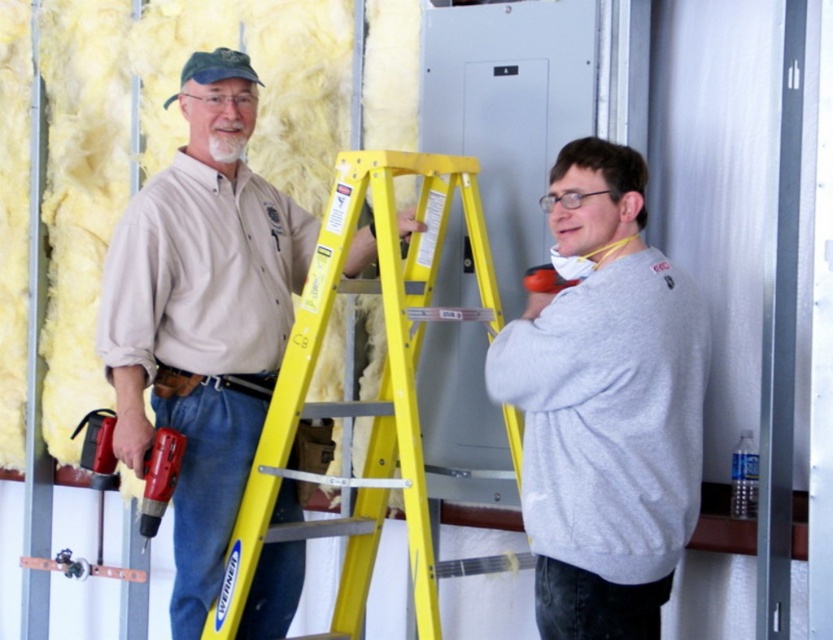
Between point (166, 435) and point (527, 282), which one is positioned behind?

Point (166, 435)

Locate an element on the screen. This screenshot has height=640, width=833. red plastic drill at lower left is located at coordinates (158, 477).

Consider the image. Who is more forward, (662, 497) or (540, 269)?

Point (662, 497)

Can you confirm if gray cotton sweatshirt at right is positioned to the left of orange rubber drill at center?

Incorrect, gray cotton sweatshirt at right is not on the left side of orange rubber drill at center.

The image size is (833, 640). What do you see at coordinates (605, 404) in the screenshot?
I see `gray cotton sweatshirt at right` at bounding box center [605, 404].

Find the location of a particular element. gray cotton sweatshirt at right is located at coordinates (605, 404).

Is yellow/yellowish metal ladder at center thinner than red plastic drill at lower left?

In fact, yellow/yellowish metal ladder at center might be wider than red plastic drill at lower left.

What are the coordinates of `yellow/yellowish metal ladder at center` in the screenshot? It's located at (378, 394).

The height and width of the screenshot is (640, 833). What do you see at coordinates (378, 394) in the screenshot?
I see `yellow/yellowish metal ladder at center` at bounding box center [378, 394].

This screenshot has width=833, height=640. What are the coordinates of `yellow/yellowish metal ladder at center` in the screenshot? It's located at (378, 394).